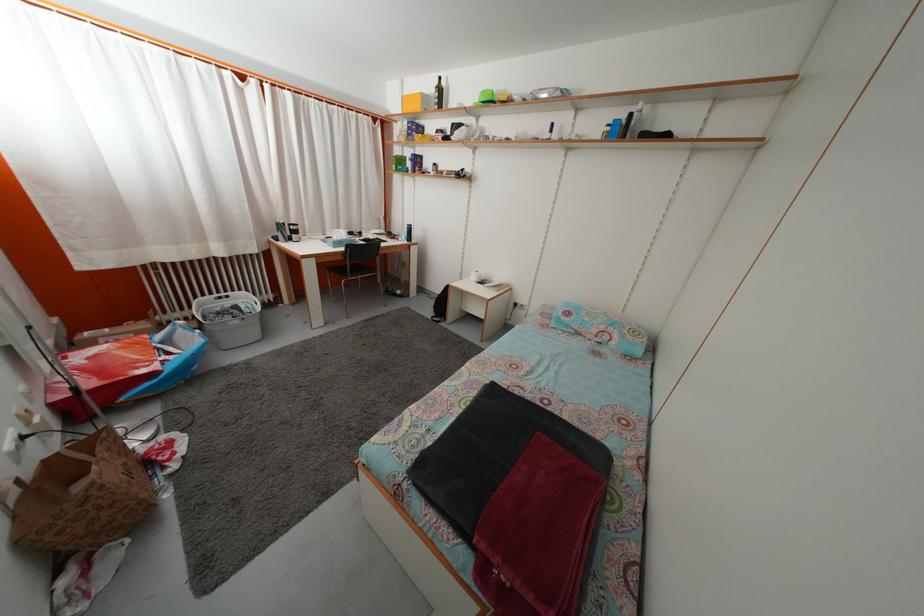
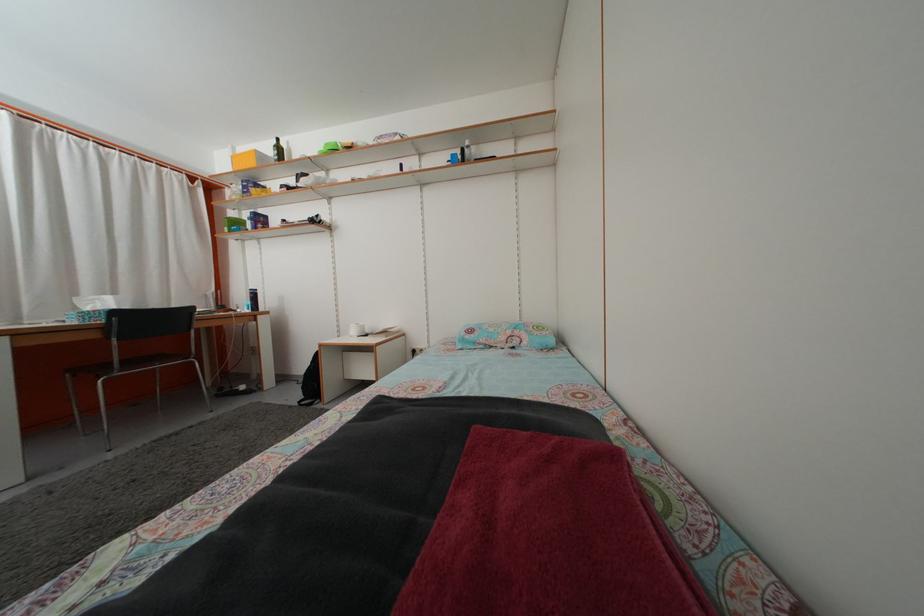
Locate, in the second image, the point that corresponds to (403,158) in the first image.

(237, 223)